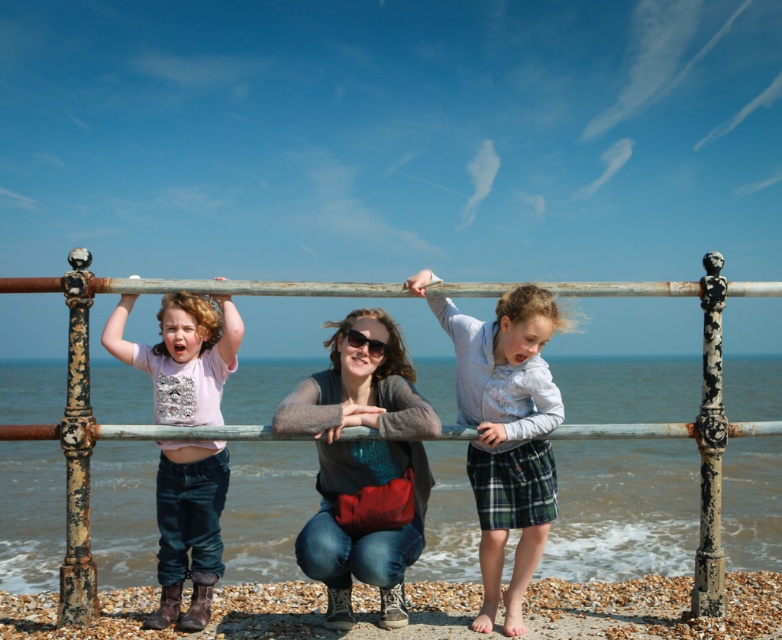
Is rusty metal railing at center to the right of matte black sunglasses at center from the viewer's perspective?

Yes, rusty metal railing at center is to the right of matte black sunglasses at center.

What do you see at coordinates (84, 435) in the screenshot?
I see `rusty metal railing at center` at bounding box center [84, 435].

What do you see at coordinates (84, 435) in the screenshot?
I see `rusty metal railing at center` at bounding box center [84, 435].

I want to click on rusty metal railing at center, so pos(84,435).

Is rusty metal pole at left to the right of matte black sunglasses at center from the viewer's perspective?

No, rusty metal pole at left is not to the right of matte black sunglasses at center.

Is point (61, 419) positioned after point (348, 336)?

Yes, point (61, 419) is farther from viewer.

The image size is (782, 640). Describe the element at coordinates (77, 452) in the screenshot. I see `rusty metal pole at left` at that location.

Locate an element on the screen. This screenshot has width=782, height=640. rusty metal pole at left is located at coordinates (77, 452).

Between smooth pebbles at lower center and rusty metal pole at center-right, which one is positioned higher?

Positioned higher is rusty metal pole at center-right.

Is point (72, 632) positioned before point (702, 444)?

Yes, point (72, 632) is closer to viewer.

The height and width of the screenshot is (640, 782). Describe the element at coordinates (655, 605) in the screenshot. I see `smooth pebbles at lower center` at that location.

At what (x,y) coordinates should I click in order to perform the action: click on smooth pebbles at lower center. Please return your answer as a coordinate pair (x, y). This screenshot has width=782, height=640. Looking at the image, I should click on (655, 605).